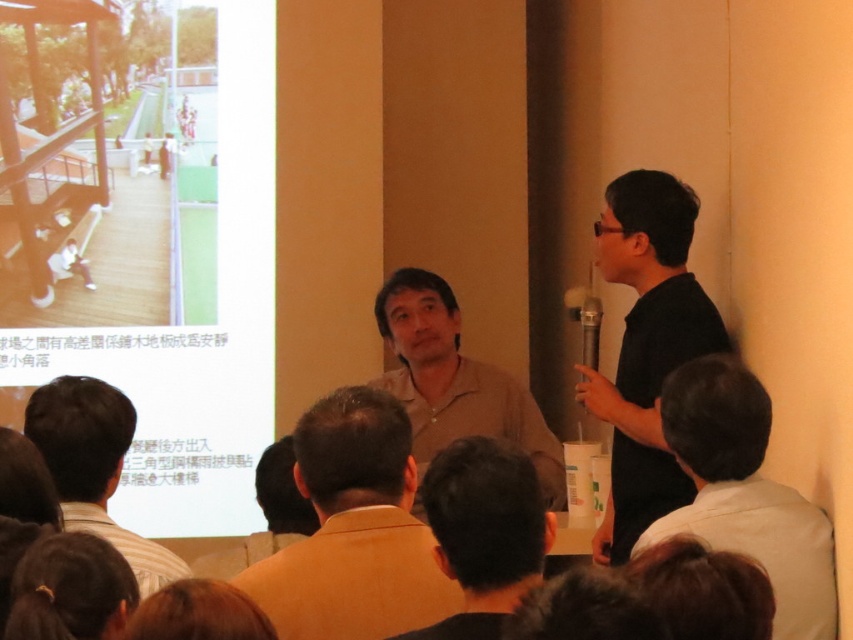
You are sitting in the audience facing the speaker. There are two points marked in the image. One is at coordinate point (x=537, y=584) and the other is at point (x=106, y=570). Which point is closer to your eyes?

Point (x=537, y=584) is further to the camera than point (x=106, y=570), so the point closer to your eyes would be point (x=106, y=570).

You are an attendee at the presentation. You notice a point marked at coordinates (485,532) on the speaker. Where exactly is this point located on the speaker?

The point is located on the black matte shirt at center of the speaker.